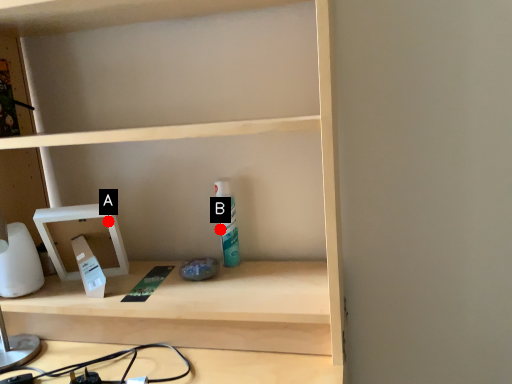
Question: Two points are circled on the image, labeled by A and B beside each circle. Which point appears farthest from the camera in this image?

Choices:
 (A) A is further
 (B) B is further

Answer: (B)